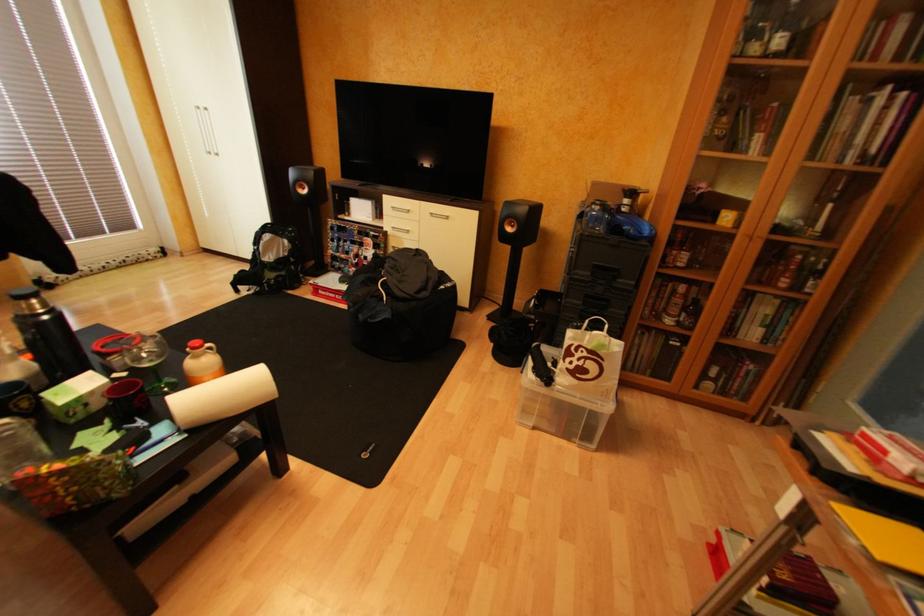
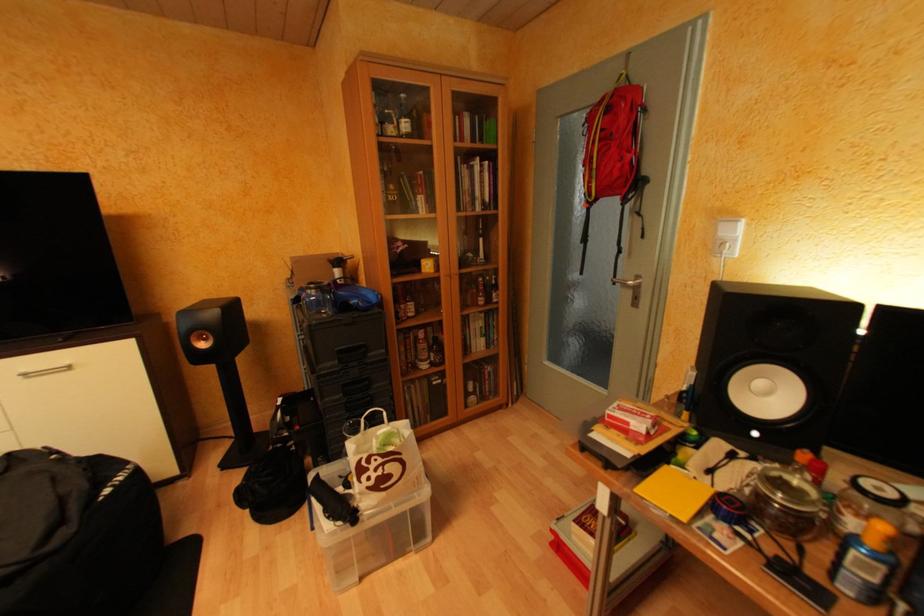
Question: The first image is from the beginning of the video and the second image is from the end. How did the camera likely rotate when shooting the video?

Choices:
 (A) Left
 (B) Right
 (C) Up
 (D) Down

Answer: (B)